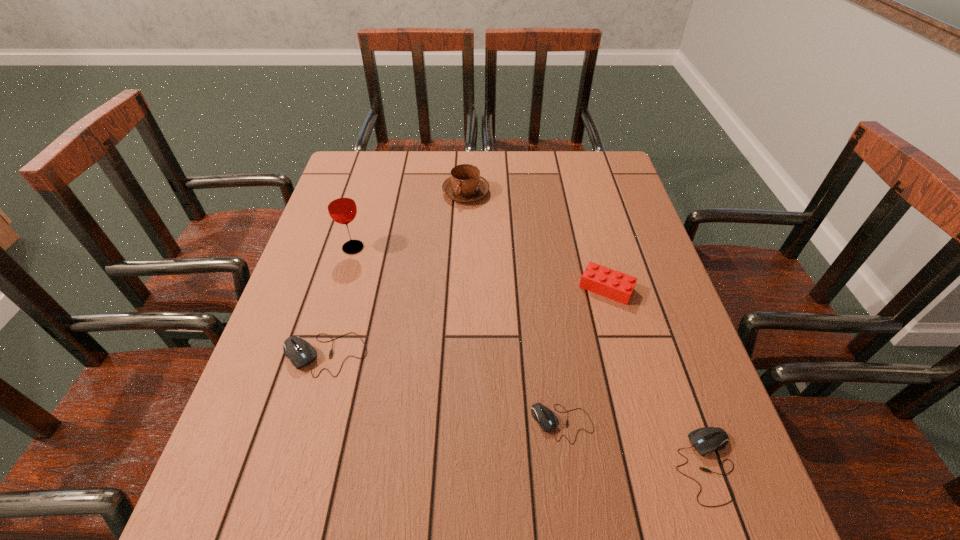
This screenshot has height=540, width=960. In order to click on the third shortest object in this screenshot , I will do `click(300, 352)`.

Identify the location of the fourth farthest object. (300, 352).

Locate an element on the screen. the fourth object from left to right is located at coordinates (544, 416).

The width and height of the screenshot is (960, 540). I want to click on the shortest computer mouse, so click(544, 416).

Find the location of a particular element. Image resolution: width=960 pixels, height=540 pixels. the second shortest computer mouse is located at coordinates (707, 439).

Find the location of a particular element. This screenshot has width=960, height=540. the fifth tallest object is located at coordinates (707, 439).

You are a GUI agent. You are given a task and a screenshot of the screen. Output one action in this format:
    pyautogui.click(x=<x>, y=<y>)
    Task: Click on the cappuccino
    The width and height of the screenshot is (960, 540).
    Given the screenshot: What is the action you would take?
    pyautogui.click(x=465, y=184)

The image size is (960, 540). What are the coordinates of `the third object from left to right` in the screenshot? It's located at (465, 184).

I want to click on the third tallest object, so click(596, 278).

In order to click on Lego in this screenshot , I will do `click(596, 278)`.